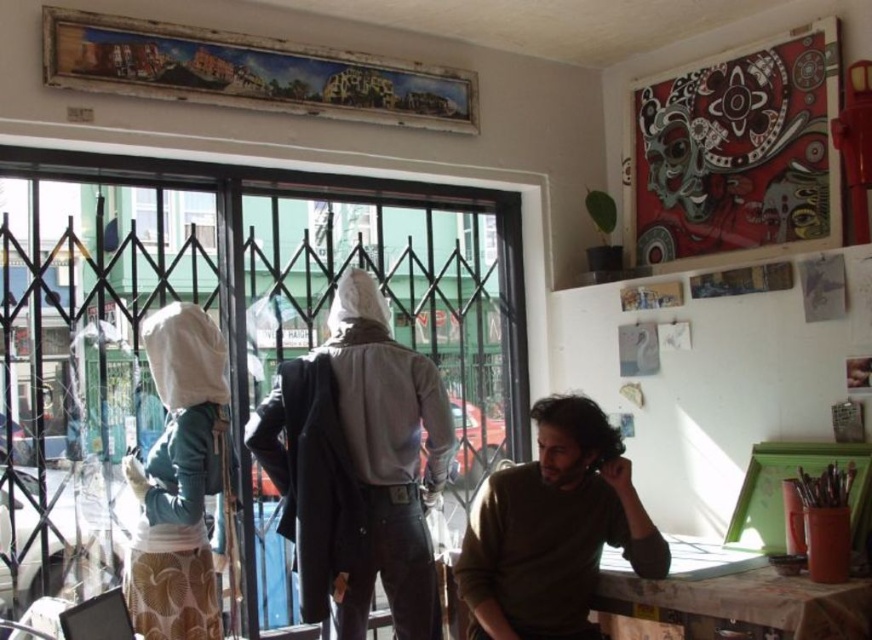
Question: Which of the following is the closest to the observer?

Choices:
 (A) (417, 472)
 (B) (195, 579)
 (C) (46, 224)
 (D) (809, 588)

Answer: (D)

Question: Is clear glass door at left thinner than matte white hoodie at center?

Choices:
 (A) no
 (B) yes

Answer: (A)

Question: Which point is closer to the camera?

Choices:
 (A) wooden table at lower right
 (B) white fabric bag at left
 (C) clear glass door at left

Answer: (A)

Question: Does matte white hoodie at center have a larger size compared to brown sweater at center?

Choices:
 (A) yes
 (B) no

Answer: (A)

Question: Where is brown sweater at center located in relation to wooden table at lower right in the image?

Choices:
 (A) below
 (B) above

Answer: (B)

Question: Which point is farther to the camera?

Choices:
 (A) matte white hoodie at center
 (B) white fabric bag at left
 (C) brown sweater at center

Answer: (A)